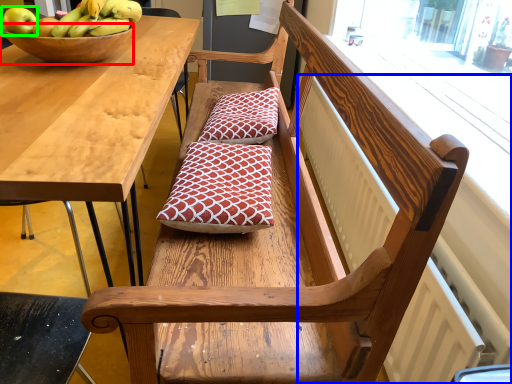
Question: Which object is the closest to the bowl (highlighted by a red box)? Choose among these: radiator (highlighted by a blue box) or apple (highlighted by a green box).

Choices:
 (A) radiator
 (B) apple

Answer: (B)